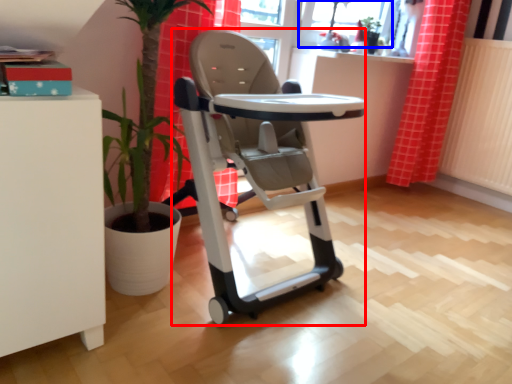
Question: Which point is further to the camera, baby carriage (highlighted by a red box) or window screen (highlighted by a blue box)?

Choices:
 (A) baby carriage
 (B) window screen

Answer: (B)